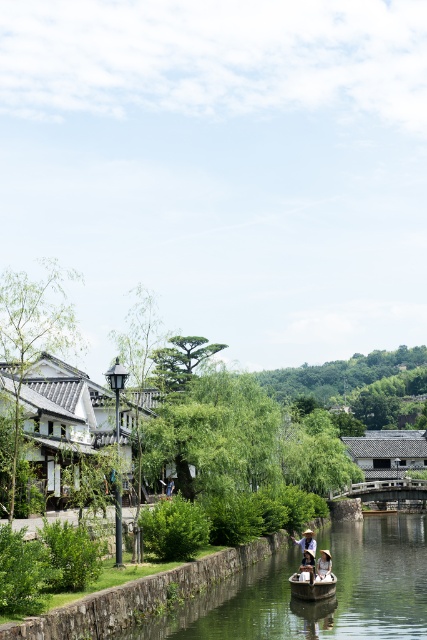
Can you confirm if smooth brown water at center is thinner than white straw hat at center?

Incorrect, smooth brown water at center's width is not less than white straw hat at center's.

Is smooth brown water at center positioned before white straw hat at center?

Yes, it is.

Which is behind, point (363, 564) or point (306, 564)?

Positioned behind is point (363, 564).

At what (x,y) coordinates should I click in order to perform the action: click on smooth brown water at center. Please return your answer as a coordinate pair (x, y). The height and width of the screenshot is (640, 427). Looking at the image, I should click on (316, 600).

Can you confirm if white straw hat at center is positioned to the left of light brown wooden boat at lower center?

Correct, you'll find white straw hat at center to the left of light brown wooden boat at lower center.

Between white straw hat at center and light brown wooden boat at lower center, which one has more height?

light brown wooden boat at lower center is taller.

Who is more forward, (312,564) or (310,538)?

Positioned in front is point (312,564).

This screenshot has width=427, height=640. Find the location of `white straw hat at center`. white straw hat at center is located at coordinates (307, 564).

Is wooden canoe at lower center above white straw hat at center?

No, wooden canoe at lower center is not above white straw hat at center.

From the picture: Who is positioned more to the left, wooden canoe at lower center or white straw hat at center?

From the viewer's perspective, white straw hat at center appears more on the left side.

Which is behind, point (307, 588) or point (313, 570)?

The point (313, 570) is behind.

I want to click on wooden canoe at lower center, so click(x=312, y=588).